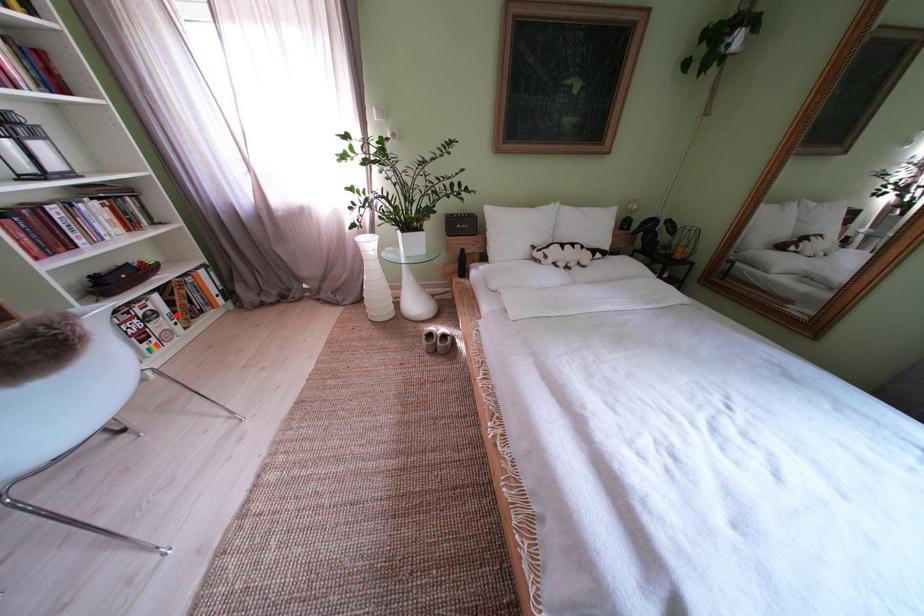
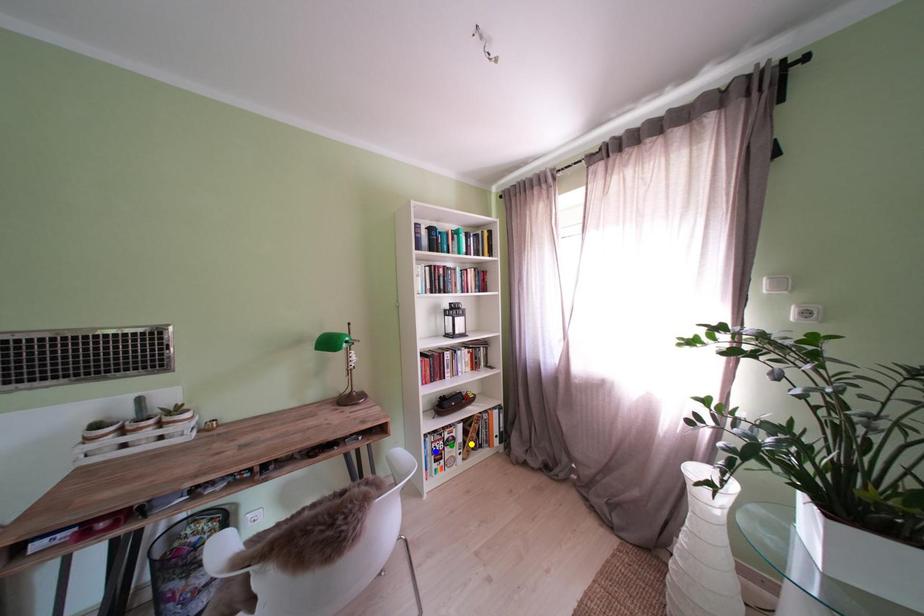
Question: I am providing you with two images of the same scene from different viewpoints. A red point is marked on the first image. You are given multiple points on the second image. Which spot in image 2 lines up with the point in image 1?

Choices:
 (A) yellow point
 (B) blue point
 (C) green point

Answer: (A)